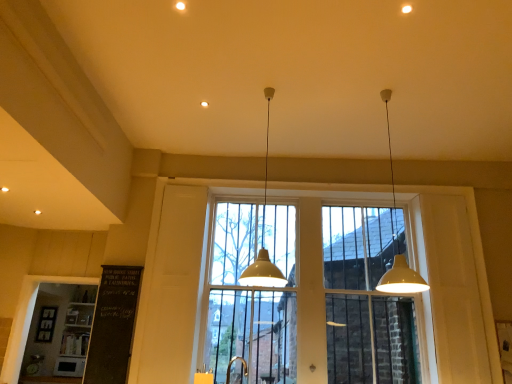
Question: Is white matte pendant light at center, which is counted as the 2th lamp, starting from the right, to the left of white matte pendant light at upper right, acting as the second lamp starting from the left, from the viewer's perspective?

Choices:
 (A) yes
 (B) no

Answer: (A)

Question: Is white matte pendant light at center, which ranks as the 1th lamp in left-to-right order, further to camera compared to white matte pendant light at upper right, which appears as the 1th lamp when viewed from the right?

Choices:
 (A) yes
 (B) no

Answer: (A)

Question: Does white matte pendant light at center, which is counted as the 2th lamp, starting from the right, contain white matte pendant light at upper right, which appears as the 1th lamp when viewed from the right?

Choices:
 (A) no
 (B) yes

Answer: (A)

Question: Is white matte pendant light at center, which is counted as the 2th lamp, starting from the right, far from white matte pendant light at upper right, which appears as the 1th lamp when viewed from the right?

Choices:
 (A) no
 (B) yes

Answer: (A)

Question: Considering the relative sizes of white matte pendant light at center, which ranks as the 1th lamp in left-to-right order, and white matte pendant light at upper right, which appears as the 1th lamp when viewed from the right, in the image provided, is white matte pendant light at center, which ranks as the 1th lamp in left-to-right order, shorter than white matte pendant light at upper right, which appears as the 1th lamp when viewed from the right,?

Choices:
 (A) yes
 (B) no

Answer: (A)

Question: Is clear glass window at center taller or shorter than white matte pendant light at upper right, acting as the second lamp starting from the left?

Choices:
 (A) short
 (B) tall

Answer: (B)

Question: From the image's perspective, relative to white matte pendant light at upper right, acting as the second lamp starting from the left, is clear glass window at center above or below?

Choices:
 (A) below
 (B) above

Answer: (A)

Question: Is point (282, 233) positioned closer to the camera than point (390, 288)?

Choices:
 (A) farther
 (B) closer

Answer: (A)

Question: Would you say clear glass window at center is to the left or to the right of white matte pendant light at upper right, which appears as the 1th lamp when viewed from the right, in the picture?

Choices:
 (A) left
 (B) right

Answer: (A)

Question: Looking at their shapes, would you say white matte pendant light at center, which ranks as the 1th lamp in left-to-right order, is wider or thinner than gold metallic faucet at lower center?

Choices:
 (A) thin
 (B) wide

Answer: (B)

Question: Considering the positions of white matte pendant light at center, which is counted as the 2th lamp, starting from the right, and gold metallic faucet at lower center in the image, is white matte pendant light at center, which is counted as the 2th lamp, starting from the right, bigger or smaller than gold metallic faucet at lower center?

Choices:
 (A) big
 (B) small

Answer: (A)

Question: From a real-world perspective, is white matte pendant light at center, which ranks as the 1th lamp in left-to-right order, physically located above or below gold metallic faucet at lower center?

Choices:
 (A) below
 (B) above

Answer: (B)

Question: From their relative heights in the image, would you say white matte pendant light at center, which is counted as the 2th lamp, starting from the right, is taller or shorter than gold metallic faucet at lower center?

Choices:
 (A) tall
 (B) short

Answer: (A)

Question: Is clear glass window at center wider or thinner than gold metallic faucet at lower center?

Choices:
 (A) wide
 (B) thin

Answer: (B)

Question: From the image's perspective, is clear glass window at center located above or below gold metallic faucet at lower center?

Choices:
 (A) below
 (B) above

Answer: (B)